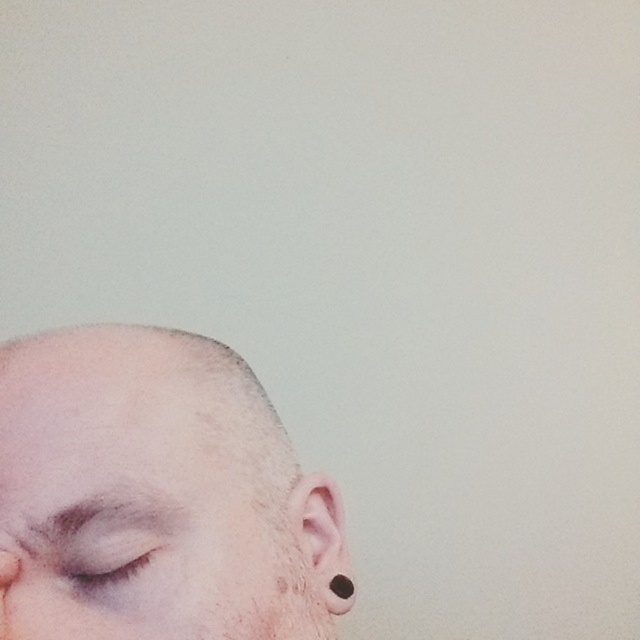
Can you confirm if smooth skin head at lower left is smaller than matte skin eye at lower left?

Actually, smooth skin head at lower left might be larger than matte skin eye at lower left.

Between smooth skin head at lower left and matte skin eye at lower left, which one appears on the right side from the viewer's perspective?

Positioned to the right is smooth skin head at lower left.

Image resolution: width=640 pixels, height=640 pixels. What are the coordinates of `smooth skin head at lower left` in the screenshot? It's located at 154,496.

Is point (13, 348) positioned after point (340, 540)?

No, (13, 348) is closer to viewer.

Describe the element at coordinates (154, 496) in the screenshot. I see `smooth skin head at lower left` at that location.

Identify the location of smooth skin head at lower left. [x=154, y=496].

Which of these two, pink matte ear at lower right or matte skin eye at lower left, stands shorter?

With less height is matte skin eye at lower left.

Consider the image. Which is more to the right, pink matte ear at lower right or matte skin eye at lower left?

From the viewer's perspective, pink matte ear at lower right appears more on the right side.

Does point (317, 497) come in front of point (120, 566)?

No.

Identify the location of pink matte ear at lower right. The image size is (640, 640). (323, 540).